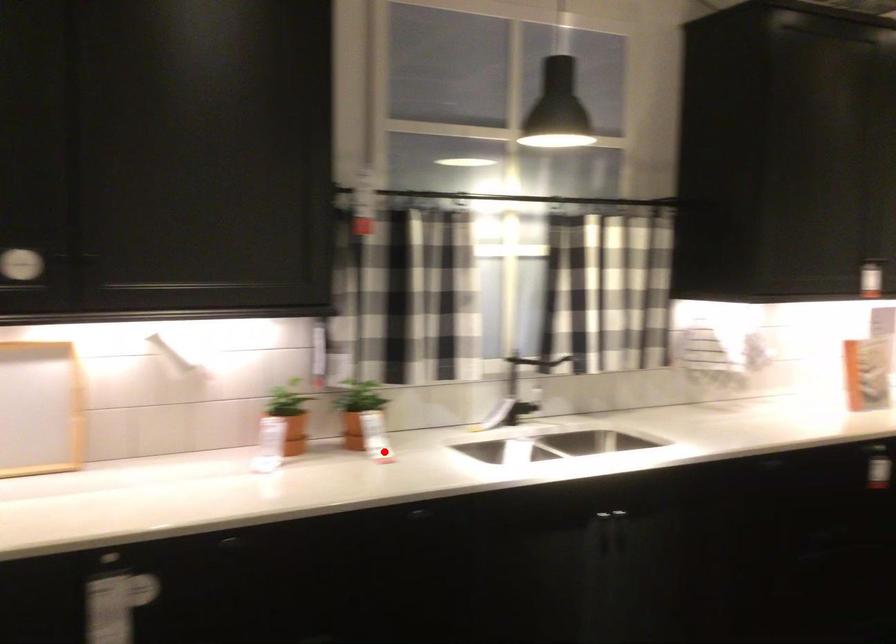
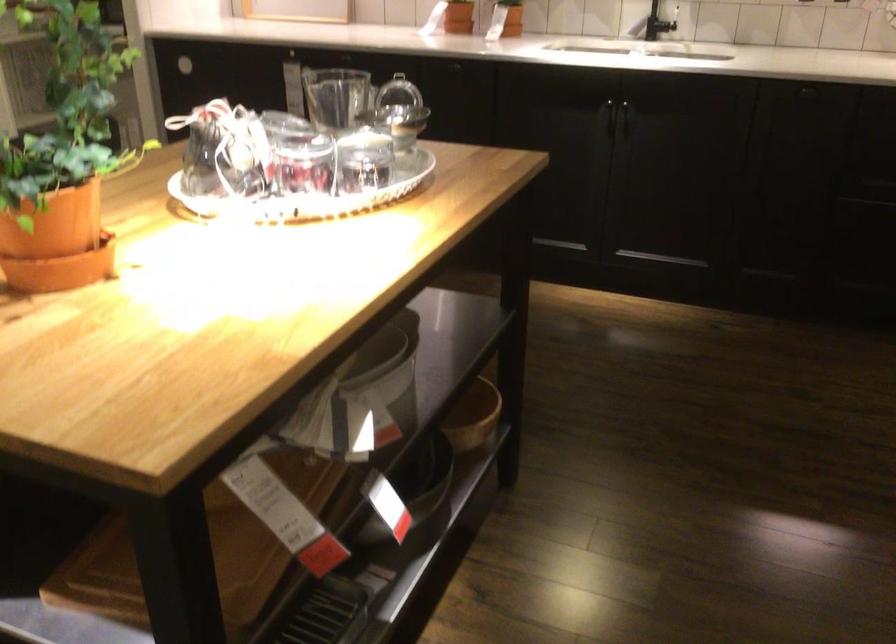
Question: I am providing you with two images of the same scene from different viewpoints. Image1 has a red point marked. In image2, the corresponding 3D location appears at what relative position? Reply with the corresponding letter.

Choices:
 (A) Closer
 (B) Farther

Answer: (B)